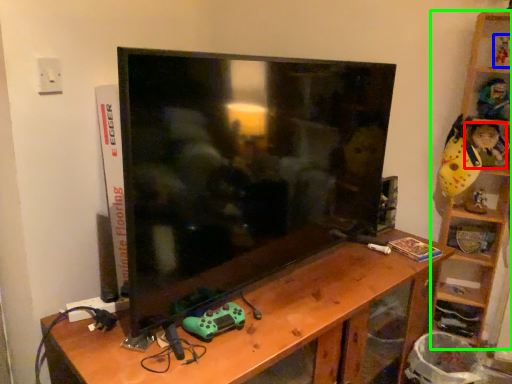
Question: Based on their relative distances, which object is farther from toy (highlighted by a red box)? Choose from toy (highlighted by a blue box) and shelf (highlighted by a green box).

Choices:
 (A) toy
 (B) shelf

Answer: (A)